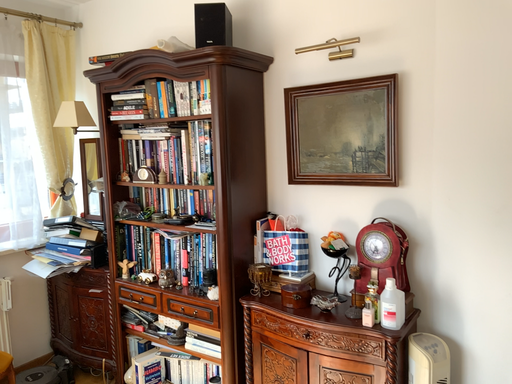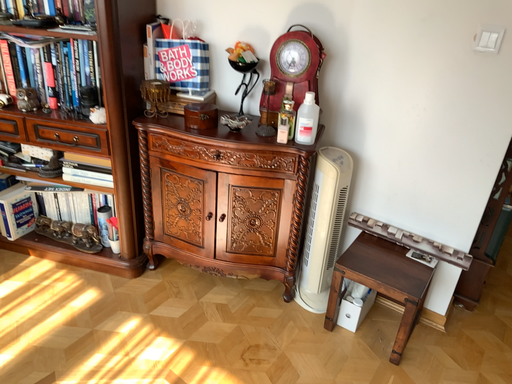
Question: Which way did the camera rotate in the video?

Choices:
 (A) rotated upward
 (B) rotated downward

Answer: (B)